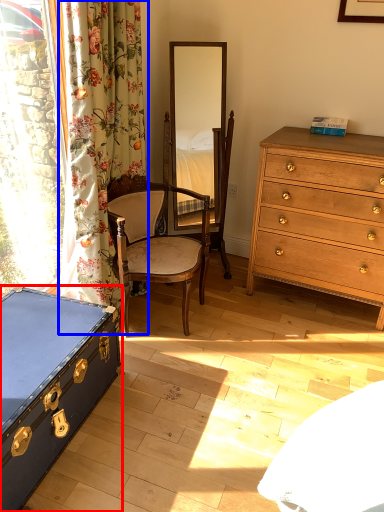
Question: Among these objects, which one is farthest to the camera, box (highlighted by a red box) or curtain (highlighted by a blue box)?

Choices:
 (A) box
 (B) curtain

Answer: (B)